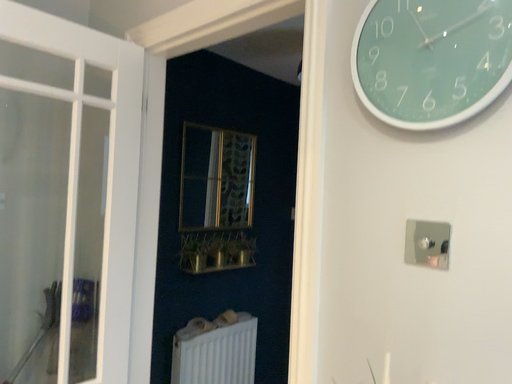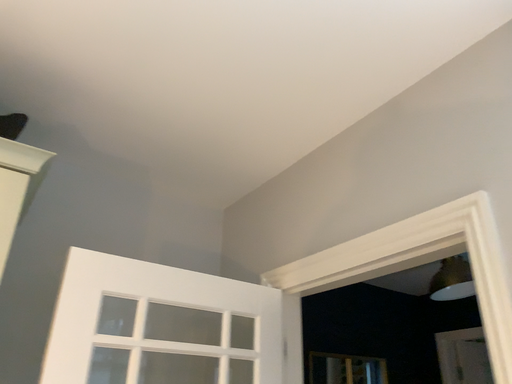
Question: How did the camera likely rotate when shooting the video?

Choices:
 (A) rotated upward
 (B) rotated downward

Answer: (A)